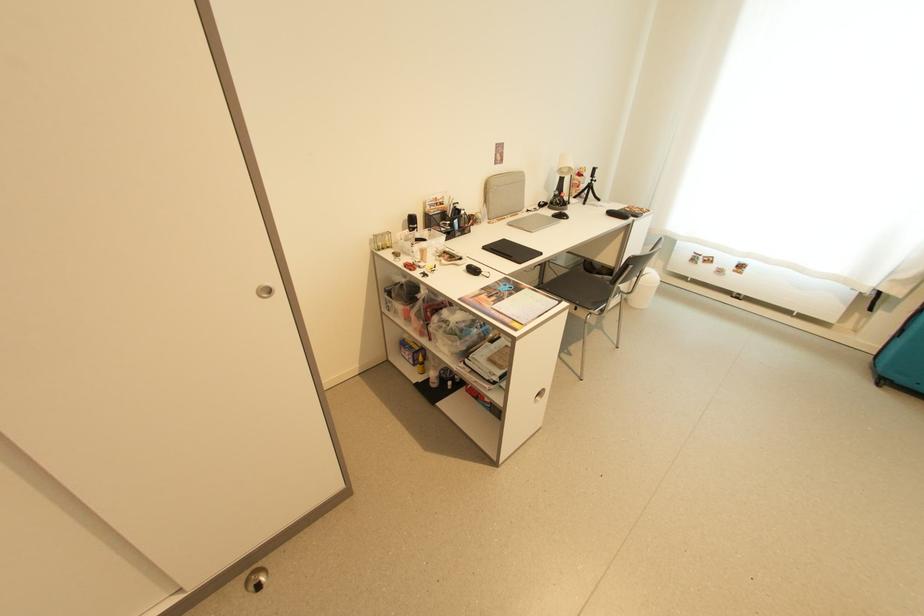
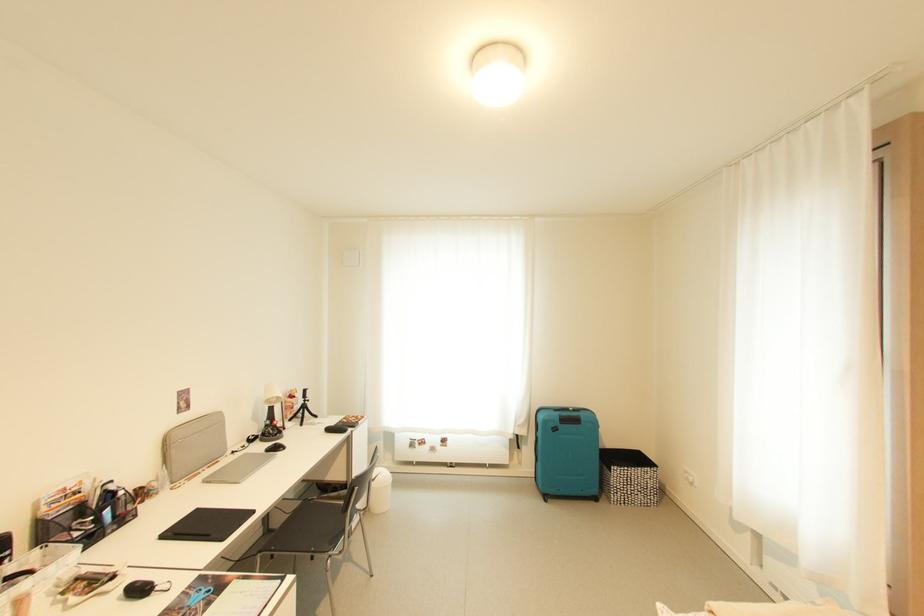
In the second image, find the point that corresponds to [582,188] in the first image.

(297, 410)